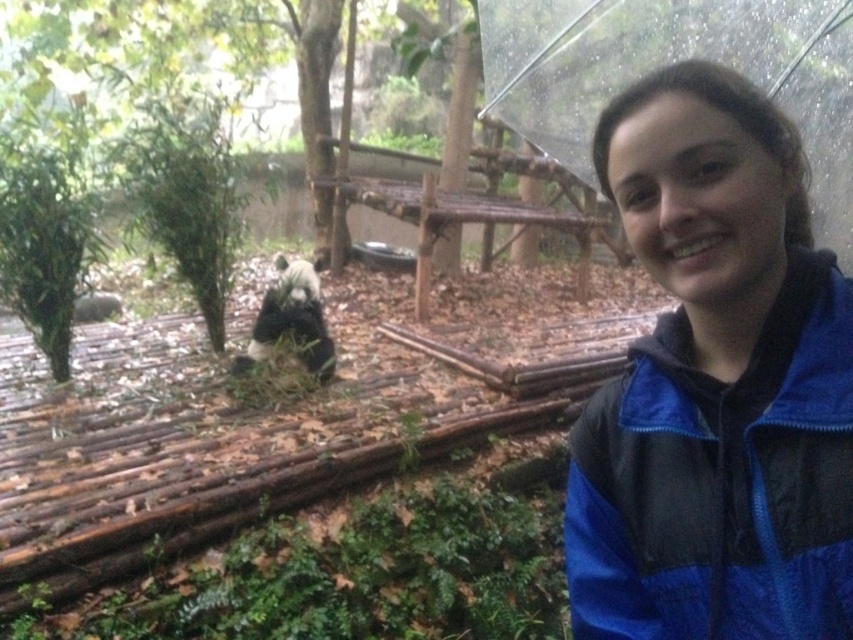
Does blue synthetic jacket at lower right have a larger size compared to black fur panda at center?

No.

Is the position of blue synthetic jacket at lower right more distant than that of black fur panda at center?

No, blue synthetic jacket at lower right is closer to the viewer.

What do you see at coordinates (720, 481) in the screenshot? This screenshot has height=640, width=853. I see `blue synthetic jacket at lower right` at bounding box center [720, 481].

Find the location of a particular element. This screenshot has height=640, width=853. blue synthetic jacket at lower right is located at coordinates (720, 481).

Is the position of transparent plastic umbrella at upper right more distant than that of black fur panda at center?

That is False.

Is transparent plastic umbrella at upper right smaller than black fur panda at center?

No.

Who is more forward, [490,19] or [279,333]?

Point [490,19] is in front.

At what (x,y) coordinates should I click in order to perform the action: click on transparent plastic umbrella at upper right. Please return your answer as a coordinate pair (x, y). Looking at the image, I should click on (671, 61).

Is blue synthetic jacket at lower right in front of transparent plastic umbrella at upper right?

Yes, it is.

Between point (801, 448) and point (641, 17), which one is positioned in front?

Point (801, 448) is in front.

Find the location of `blue synthetic jacket at lower right`. blue synthetic jacket at lower right is located at coordinates (720, 481).